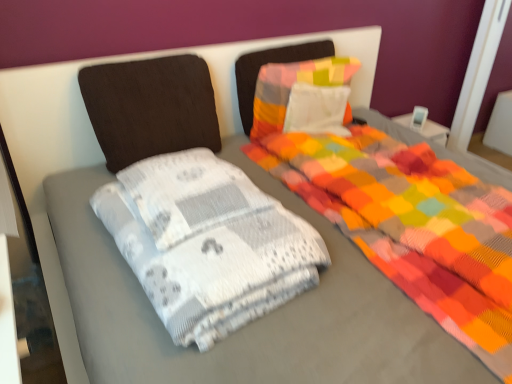
What do you see at coordinates (291, 87) in the screenshot?
I see `multicolored fabric pillow at center, the 2th pillow from the left` at bounding box center [291, 87].

Measure the distance between white textured blanket at center and camera.

white textured blanket at center is 3.33 feet away from camera.

This screenshot has height=384, width=512. Identify the location of dark brown fabric pillow at upper left, placed as the 1th pillow when sorted from left to right. [150, 107].

Considering the sizes of white textured blanket at center and dark brown fabric pillow at upper left, which is the second pillow from right to left, in the image, is white textured blanket at center taller or shorter than dark brown fabric pillow at upper left, which is the second pillow from right to left,?

Clearly, white textured blanket at center is shorter compared to dark brown fabric pillow at upper left, which is the second pillow from right to left.

Do you think white textured blanket at center is within dark brown fabric pillow at upper left, placed as the 1th pillow when sorted from left to right, or outside of it?

white textured blanket at center is not enclosed by dark brown fabric pillow at upper left, placed as the 1th pillow when sorted from left to right.

Between point (179, 271) and point (96, 79), which one is positioned behind?

The point (96, 79) is farther from the camera.

Considering the relative positions of white textured blanket at center and dark brown fabric pillow at upper left, placed as the 1th pillow when sorted from left to right, in the image provided, is white textured blanket at center to the left of dark brown fabric pillow at upper left, placed as the 1th pillow when sorted from left to right, from the viewer's perspective?

In fact, white textured blanket at center is to the right of dark brown fabric pillow at upper left, placed as the 1th pillow when sorted from left to right.

Consider the image. How different are the orientations of multicolored fabric pillow at center, the 2th pillow from the left, and dark brown fabric pillow at upper left, placed as the 1th pillow when sorted from left to right, in degrees?

multicolored fabric pillow at center, the 2th pillow from the left, and dark brown fabric pillow at upper left, placed as the 1th pillow when sorted from left to right, are facing 3.86 degrees away from each other.

Between multicolored fabric pillow at center, the 2th pillow from the left, and dark brown fabric pillow at upper left, which is the second pillow from right to left, which one has smaller size?

With smaller size is multicolored fabric pillow at center, the 2th pillow from the left.

From a real-world perspective, between multicolored fabric pillow at center, the 2th pillow from the left, and dark brown fabric pillow at upper left, which is the second pillow from right to left, who is vertically lower?

multicolored fabric pillow at center, the 2th pillow from the left, from a real-world perspective.

Could you measure the distance between multicolored fabric pillow at center, the 1th pillow in the right-to-left sequence, and white textured blanket at center?

32.75 inches.

From the picture: Can you confirm if multicolored fabric pillow at center, the 2th pillow from the left, is smaller than white textured blanket at center?

Correct, multicolored fabric pillow at center, the 2th pillow from the left, occupies less space than white textured blanket at center.

Which is farther from the camera, [349,114] or [212,226]?

The point [349,114] is farther from the camera.

Is multicolored fabric pillow at center, the 2th pillow from the left, directly adjacent to white textured blanket at center?

There is a gap between multicolored fabric pillow at center, the 2th pillow from the left, and white textured blanket at center.

Between dark brown fabric pillow at upper left, placed as the 1th pillow when sorted from left to right, and multicolored fabric pillow at center, the 1th pillow in the right-to-left sequence, which one has smaller size?

Smaller between the two is multicolored fabric pillow at center, the 1th pillow in the right-to-left sequence.

Considering the relative sizes of dark brown fabric pillow at upper left, placed as the 1th pillow when sorted from left to right, and multicolored fabric pillow at center, the 2th pillow from the left, in the image provided, is dark brown fabric pillow at upper left, placed as the 1th pillow when sorted from left to right, wider than multicolored fabric pillow at center, the 2th pillow from the left,?

No, dark brown fabric pillow at upper left, placed as the 1th pillow when sorted from left to right, is not wider than multicolored fabric pillow at center, the 2th pillow from the left.

Does dark brown fabric pillow at upper left, placed as the 1th pillow when sorted from left to right, appear on the left side of multicolored fabric pillow at center, the 1th pillow in the right-to-left sequence?

Yes.

From a real-world perspective, which object rests below the other?

From a 3D spatial view, multicolored fabric pillow at center, the 2th pillow from the left, is below.

Is white textured blanket at center at the back of dark brown fabric pillow at upper left, placed as the 1th pillow when sorted from left to right?

No.

From a real-world perspective, is dark brown fabric pillow at upper left, placed as the 1th pillow when sorted from left to right, positioned over white textured blanket at center based on gravity?

Correct, in the physical world, dark brown fabric pillow at upper left, placed as the 1th pillow when sorted from left to right, is higher than white textured blanket at center.

Is point (195, 58) closer or farther from the camera than point (218, 331)?

Clearly, point (195, 58) is more distant from the camera than point (218, 331).

In terms of width, does white textured blanket at center look wider or thinner when compared to multicolored fabric pillow at center, the 1th pillow in the right-to-left sequence?

In the image, white textured blanket at center appears to be wider than multicolored fabric pillow at center, the 1th pillow in the right-to-left sequence.

Would you say white textured blanket at center is inside or outside multicolored fabric pillow at center, the 2th pillow from the left?

white textured blanket at center cannot be found inside multicolored fabric pillow at center, the 2th pillow from the left.

Looking at the image, does white textured blanket at center seem bigger or smaller compared to multicolored fabric pillow at center, the 2th pillow from the left?

white textured blanket at center is bigger than multicolored fabric pillow at center, the 2th pillow from the left.

From the image's perspective, does white textured blanket at center appear higher than multicolored fabric pillow at center, the 2th pillow from the left?

Incorrect, from the image's perspective, white textured blanket at center is lower than multicolored fabric pillow at center, the 2th pillow from the left.

This screenshot has height=384, width=512. Identify the location of material to the right of dark brown fabric pillow at upper left, which is the second pillow from right to left. (207, 243).

Identify the location of pillow below the dark brown fabric pillow at upper left, placed as the 1th pillow when sorted from left to right (from a real-world perspective). (291, 87).

Estimate the real-world distances between objects in this image. Which object is closer to multicolored fabric pillow at center, the 2th pillow from the left, dark brown fabric pillow at upper left, which is the second pillow from right to left, or white textured blanket at center?

The object closer to multicolored fabric pillow at center, the 2th pillow from the left, is dark brown fabric pillow at upper left, which is the second pillow from right to left.

Based on their spatial positions, is multicolored fabric pillow at center, the 1th pillow in the right-to-left sequence, or white textured blanket at center closer to dark brown fabric pillow at upper left, placed as the 1th pillow when sorted from left to right?

multicolored fabric pillow at center, the 1th pillow in the right-to-left sequence, lies closer to dark brown fabric pillow at upper left, placed as the 1th pillow when sorted from left to right, than the other object.

Which object lies nearer to the anchor point multicolored fabric pillow at center, the 2th pillow from the left, white textured blanket at center or dark brown fabric pillow at upper left, which is the second pillow from right to left?

The object closer to multicolored fabric pillow at center, the 2th pillow from the left, is dark brown fabric pillow at upper left, which is the second pillow from right to left.

Based on the photo, which object lies nearer to the anchor point dark brown fabric pillow at upper left, placed as the 1th pillow when sorted from left to right, white textured blanket at center or multicolored fabric pillow at center, the 2th pillow from the left?

multicolored fabric pillow at center, the 2th pillow from the left, lies closer to dark brown fabric pillow at upper left, placed as the 1th pillow when sorted from left to right, than the other object.

Based on their spatial positions, is dark brown fabric pillow at upper left, placed as the 1th pillow when sorted from left to right, or multicolored fabric pillow at center, the 2th pillow from the left, further from white textured blanket at center?

The object further to white textured blanket at center is multicolored fabric pillow at center, the 2th pillow from the left.

When comparing their distances from white textured blanket at center, does multicolored fabric pillow at center, the 1th pillow in the right-to-left sequence, or dark brown fabric pillow at upper left, which is the second pillow from right to left, seem closer?

dark brown fabric pillow at upper left, which is the second pillow from right to left, is positioned closer to the anchor white textured blanket at center.

Identify the location of pillow positioned between white textured blanket at center and multicolored fabric pillow at center, the 2th pillow from the left, from near to far. The image size is (512, 384). (150, 107).